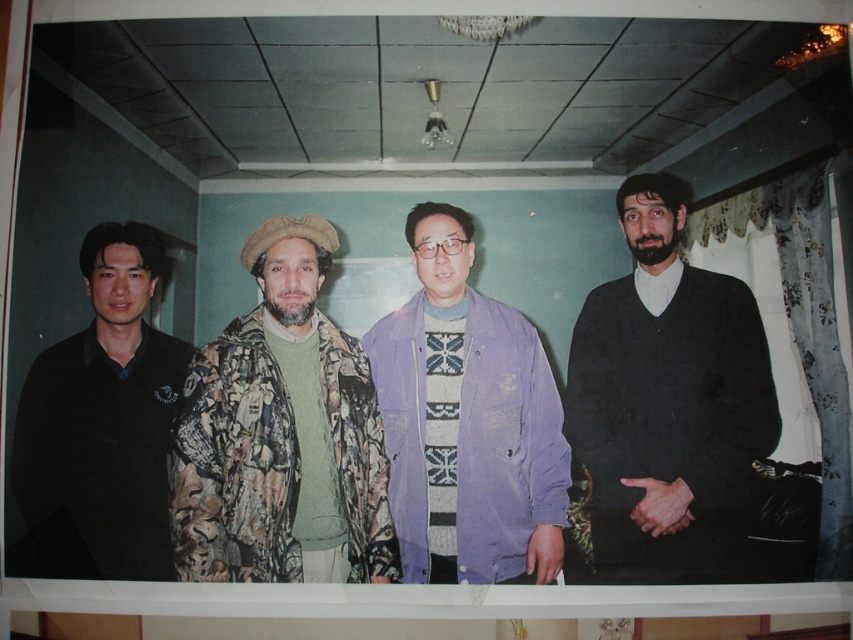
Question: Among these objects, which one is nearest to the camera?

Choices:
 (A) black matte shirt at left
 (B) dark gray sweater at right

Answer: (A)

Question: Does camouflage jacket at center have a smaller size compared to purple corduroy jacket at center?

Choices:
 (A) no
 (B) yes

Answer: (A)

Question: Among these objects, which one is nearest to the camera?

Choices:
 (A) purple corduroy jacket at center
 (B) dark gray sweater at right
 (C) black matte shirt at left
 (D) camouflage jacket at center

Answer: (D)

Question: In this image, where is dark gray sweater at right located relative to purple corduroy jacket at center?

Choices:
 (A) right
 (B) left

Answer: (A)

Question: Among these objects, which one is nearest to the camera?

Choices:
 (A) black matte shirt at left
 (B) camouflage jacket at center
 (C) purple corduroy jacket at center

Answer: (B)

Question: Does camouflage jacket at center have a lesser width compared to black matte shirt at left?

Choices:
 (A) no
 (B) yes

Answer: (A)